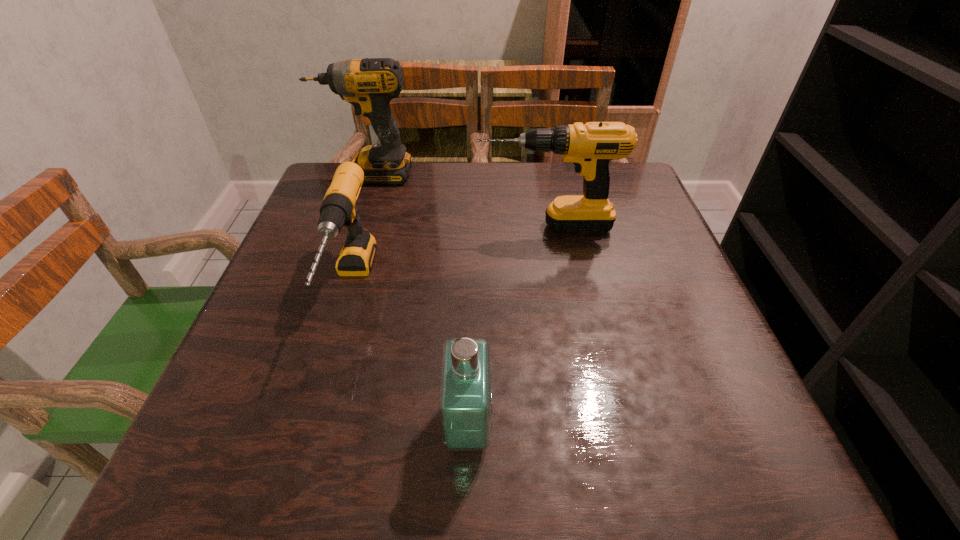
Image resolution: width=960 pixels, height=540 pixels. I want to click on the farthest drill, so click(x=369, y=85).

I want to click on the tallest object, so click(x=369, y=85).

At what (x,y) coordinates should I click in order to perform the action: click on the third shortest object. Please return your answer as a coordinate pair (x, y). The height and width of the screenshot is (540, 960). Looking at the image, I should click on (590, 146).

Locate an element on the screen. The height and width of the screenshot is (540, 960). the rightmost drill is located at coordinates (590, 146).

Identify the location of the shortest drill. The image size is (960, 540). (338, 208).

What are the coordinates of `the nearest object` in the screenshot? It's located at (465, 392).

You are a GUI agent. You are given a task and a screenshot of the screen. Output one action in this format:
    pyautogui.click(x=<x>, y=<y>)
    Task: Click on the free space located at the tip of the second tallest object
    This screenshot has height=540, width=960.
    Given the screenshot: What is the action you would take?
    pyautogui.click(x=343, y=226)

The width and height of the screenshot is (960, 540). Identify the location of vacant space located 0.090m at the tip of the second tallest object. (437, 226).

The height and width of the screenshot is (540, 960). Identify the location of vacant space located 0.100m at the tip of the second tallest object. (433, 226).

Find the location of `blank area located 0.090m on the handle side of the shortest drill`. blank area located 0.090m on the handle side of the shortest drill is located at coordinates (318, 397).